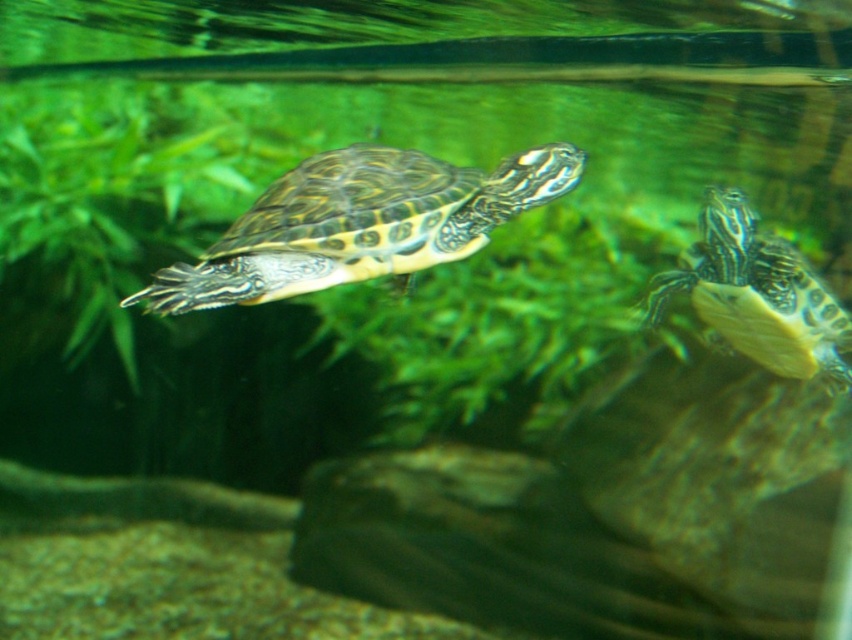
Does point (271, 234) come behind point (801, 314)?

No.

Locate an element on the screen. This screenshot has width=852, height=640. patterned shell turtle at center is located at coordinates (360, 224).